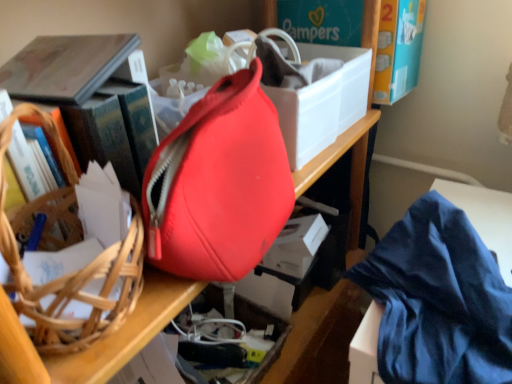
Question: In the image, is hardcover book at left on the left side or the right side of matte red bag at center?

Choices:
 (A) right
 (B) left

Answer: (B)

Question: In the image, is hardcover book at left positioned in front of or behind matte red bag at center?

Choices:
 (A) behind
 (B) front

Answer: (A)

Question: Estimate the real-world distances between objects in this image. Which object is farther from the matte red bag at center?

Choices:
 (A) brown woven basket at left
 (B) blue silky cloth at lower right
 (C) hardcover book at left
 (D) white matte storage box at center

Answer: (D)

Question: Estimate the real-world distances between objects in this image. Which object is farther from the white matte storage box at center?

Choices:
 (A) matte red bag at center
 (B) blue silky cloth at lower right
 (C) hardcover book at left
 (D) brown woven basket at left

Answer: (D)